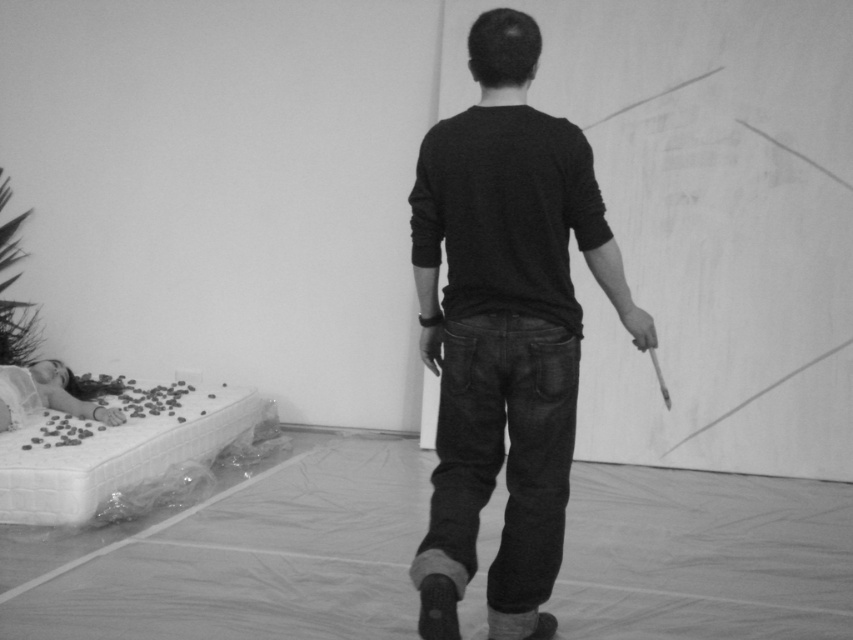
Question: Among these points, which one is farthest from the camera?

Choices:
 (A) (554, 122)
 (B) (68, 390)

Answer: (B)

Question: Does black matte shirt at center have a lesser width compared to smooth white doll at lower left?

Choices:
 (A) no
 (B) yes

Answer: (B)

Question: Is black matte shirt at center below smooth white doll at lower left?

Choices:
 (A) no
 (B) yes

Answer: (A)

Question: Can you confirm if black matte shirt at center is smaller than smooth white doll at lower left?

Choices:
 (A) no
 (B) yes

Answer: (A)